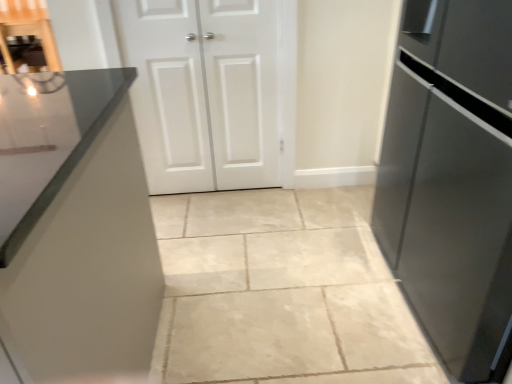
I want to click on white matte door at center, the second door viewed from the left, so click(242, 91).

Find the location of `white matte door at center, the second door viewed from the left`. white matte door at center, the second door viewed from the left is located at coordinates (242, 91).

Can you tell me how much white matte door at center, the second door viewed from the left, and satin black refrigerator at right differ in facing direction?

There is a 91.7-degree angle between the facing directions of white matte door at center, the second door viewed from the left, and satin black refrigerator at right.

Could you tell me if white matte door at center, acting as the first door starting from the right, is turned towards satin black refrigerator at right?

No.

From the image's perspective, which one is positioned higher, white matte door at center, acting as the first door starting from the right, or satin black refrigerator at right?

white matte door at center, acting as the first door starting from the right.

Which of these two, white matte door at center, acting as the first door starting from the right, or satin black refrigerator at right, is thinner?

With smaller width is white matte door at center, acting as the first door starting from the right.

Could you tell me if satin black refrigerator at right is turned towards white matte cabinet doors at center, marked as the first door in a left-to-right arrangement?

No, satin black refrigerator at right is not aimed at white matte cabinet doors at center, marked as the first door in a left-to-right arrangement.

Is satin black refrigerator at right thinner than white matte cabinet doors at center, marked as the first door in a left-to-right arrangement?

No, satin black refrigerator at right is not thinner than white matte cabinet doors at center, marked as the first door in a left-to-right arrangement.

Considering the relative sizes of satin black refrigerator at right and white matte cabinet doors at center, which is the 2th door in right-to-left order, in the image provided, is satin black refrigerator at right bigger than white matte cabinet doors at center, which is the 2th door in right-to-left order,?

Indeed, satin black refrigerator at right has a larger size compared to white matte cabinet doors at center, which is the 2th door in right-to-left order.

Would you say satin black refrigerator at right is part of white matte cabinet doors at center, marked as the first door in a left-to-right arrangement,'s contents?

Definitely not — satin black refrigerator at right is not inside white matte cabinet doors at center, marked as the first door in a left-to-right arrangement.

Who is taller, white matte cabinet doors at center, marked as the first door in a left-to-right arrangement, or satin black refrigerator at right?

satin black refrigerator at right.

Considering the sizes of white matte cabinet doors at center, marked as the first door in a left-to-right arrangement, and satin black refrigerator at right in the image, is white matte cabinet doors at center, marked as the first door in a left-to-right arrangement, wider or thinner than satin black refrigerator at right?

Considering their sizes, white matte cabinet doors at center, marked as the first door in a left-to-right arrangement, looks slimmer than satin black refrigerator at right.

Could you tell me if white matte door at center, acting as the first door starting from the right, is turned towards white matte cabinet doors at center, which is the 2th door in right-to-left order?

Yes, white matte door at center, acting as the first door starting from the right, is facing white matte cabinet doors at center, which is the 2th door in right-to-left order.

Considering the sizes of objects white matte door at center, the second door viewed from the left, and white matte cabinet doors at center, marked as the first door in a left-to-right arrangement, in the image provided, who is thinner, white matte door at center, the second door viewed from the left, or white matte cabinet doors at center, marked as the first door in a left-to-right arrangement,?

Thinner between the two is white matte door at center, the second door viewed from the left.

Considering the sizes of objects white matte door at center, acting as the first door starting from the right, and white matte cabinet doors at center, which is the 2th door in right-to-left order, in the image provided, who is taller, white matte door at center, acting as the first door starting from the right, or white matte cabinet doors at center, which is the 2th door in right-to-left order,?

white matte cabinet doors at center, which is the 2th door in right-to-left order, is taller.

How far apart are white matte door at center, acting as the first door starting from the right, and white matte cabinet doors at center, which is the 2th door in right-to-left order?

white matte door at center, acting as the first door starting from the right, and white matte cabinet doors at center, which is the 2th door in right-to-left order, are 2.80 inches apart.

This screenshot has width=512, height=384. What are the coordinates of `door that is in front of the white matte door at center, the second door viewed from the left` in the screenshot? It's located at (205, 91).

Who is smaller, white matte cabinet doors at center, which is the 2th door in right-to-left order, or white matte door at center, acting as the first door starting from the right?

Smaller between the two is white matte door at center, acting as the first door starting from the right.

Which of these two, white matte cabinet doors at center, which is the 2th door in right-to-left order, or white matte door at center, the second door viewed from the left, is thinner?

white matte door at center, the second door viewed from the left.

Looking at this image, does satin black refrigerator at right have a lesser width compared to white matte door at center, acting as the first door starting from the right?

No, satin black refrigerator at right is not thinner than white matte door at center, acting as the first door starting from the right.

Consider the image. Is satin black refrigerator at right aimed at white matte door at center, acting as the first door starting from the right?

No, satin black refrigerator at right is not turned towards white matte door at center, acting as the first door starting from the right.

Consider the image. Is satin black refrigerator at right to the left or to the right of white matte door at center, the second door viewed from the left, in the image?

Clearly, satin black refrigerator at right is on the right of white matte door at center, the second door viewed from the left, in the image.

Locate an element on the screen. The image size is (512, 384). refrigerator that is above the white matte door at center, the second door viewed from the left (from a real-world perspective) is located at coordinates (452, 179).

I want to click on refrigerator on the right of white matte cabinet doors at center, which is the 2th door in right-to-left order, so coord(452,179).

Looking at this image, when comparing their distances from white matte door at center, the second door viewed from the left, does satin black refrigerator at right or white matte cabinet doors at center, which is the 2th door in right-to-left order, seem closer?

Based on the image, white matte cabinet doors at center, which is the 2th door in right-to-left order, appears to be nearer to white matte door at center, the second door viewed from the left.

Based on their spatial positions, is white matte door at center, acting as the first door starting from the right, or white matte cabinet doors at center, which is the 2th door in right-to-left order, further from satin black refrigerator at right?

white matte cabinet doors at center, which is the 2th door in right-to-left order, lies further to satin black refrigerator at right than the other object.

From the image, which object appears to be farther from satin black refrigerator at right, white matte cabinet doors at center, marked as the first door in a left-to-right arrangement, or white matte door at center, the second door viewed from the left?

white matte cabinet doors at center, marked as the first door in a left-to-right arrangement, is positioned further to the anchor satin black refrigerator at right.

In the scene shown: From the image, which object appears to be farther from white matte cabinet doors at center, which is the 2th door in right-to-left order, satin black refrigerator at right or white matte door at center, acting as the first door starting from the right?

satin black refrigerator at right.

Consider the image. Estimate the real-world distances between objects in this image. Which object is closer to white matte door at center, acting as the first door starting from the right, white matte cabinet doors at center, which is the 2th door in right-to-left order, or satin black refrigerator at right?

white matte cabinet doors at center, which is the 2th door in right-to-left order, lies closer to white matte door at center, acting as the first door starting from the right, than the other object.

Looking at the image, which one is located closer to white matte cabinet doors at center, marked as the first door in a left-to-right arrangement, white matte door at center, acting as the first door starting from the right, or satin black refrigerator at right?

white matte door at center, acting as the first door starting from the right, is positioned closer to the anchor white matte cabinet doors at center, marked as the first door in a left-to-right arrangement.

Identify the location of door located between satin black refrigerator at right and white matte door at center, acting as the first door starting from the right, in the depth direction. Image resolution: width=512 pixels, height=384 pixels. (205, 91).